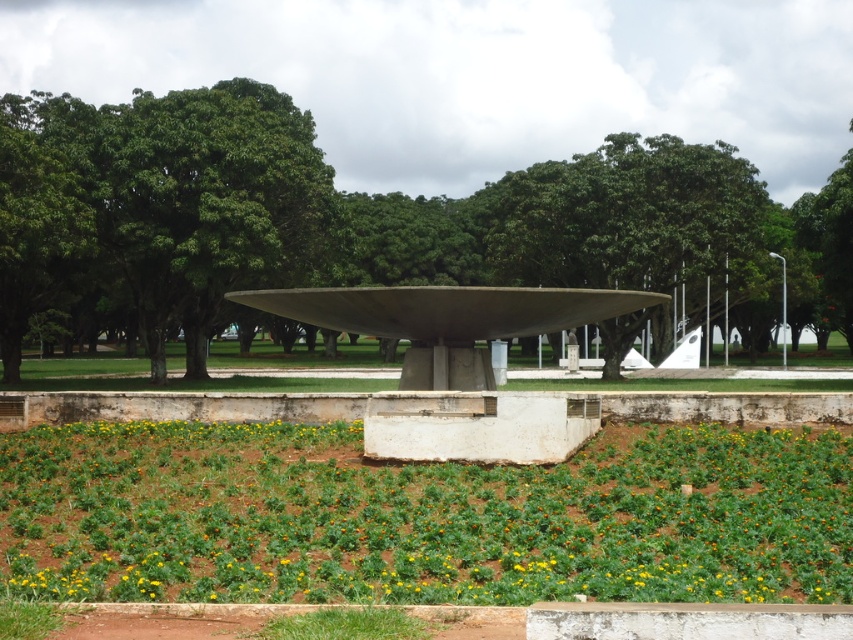
Question: Is green leafy tree at center to the right of green leafy tree at upper left from the viewer's perspective?

Choices:
 (A) yes
 (B) no

Answer: (A)

Question: Which object is closer to the camera taking this photo?

Choices:
 (A) green leafy tree at center
 (B) green leafy plant at lower center

Answer: (B)

Question: Does green leafy tree at center lie behind green leafy tree at upper left?

Choices:
 (A) yes
 (B) no

Answer: (A)

Question: Estimate the real-world distances between objects in this image. Which object is closer to the green leafy tree at center?

Choices:
 (A) green leafy plant at lower center
 (B) green leafy tree at upper left

Answer: (B)

Question: Does green leafy tree at center have a lesser width compared to green leafy tree at upper left?

Choices:
 (A) yes
 (B) no

Answer: (B)

Question: Which is farther from the green leafy tree at center?

Choices:
 (A) green leafy tree at upper left
 (B) green leafy plant at lower center

Answer: (B)